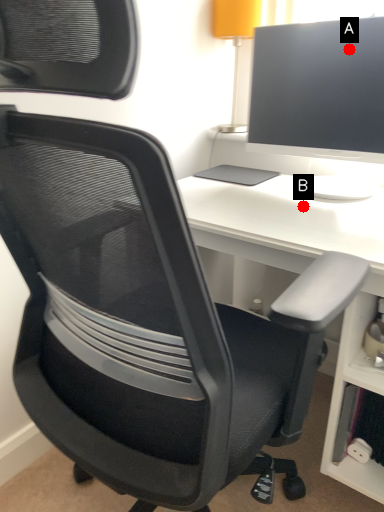
Question: Two points are circled on the image, labeled by A and B beside each circle. Which point is closer to the camera?

Choices:
 (A) A is closer
 (B) B is closer

Answer: (A)